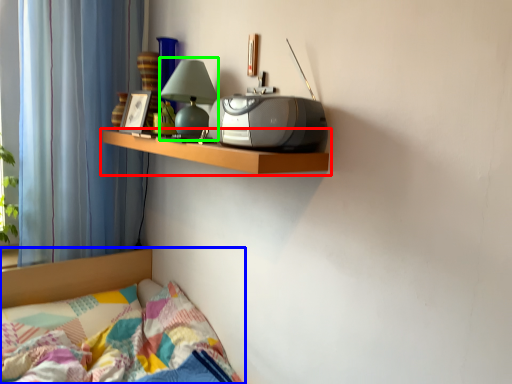
Question: Considering the real-world distances, which object is farthest from shelf (highlighted by a red box)? bed (highlighted by a blue box) or table lamp (highlighted by a green box)?

Choices:
 (A) bed
 (B) table lamp

Answer: (A)